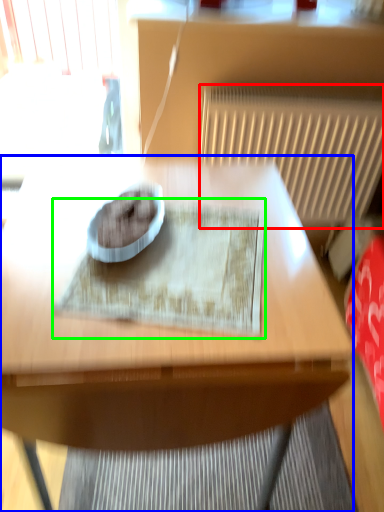
Question: Considering the real-world distances, which object is farthest from radiator (highlighted by a red box)? table (highlighted by a blue box) or mat (highlighted by a green box)?

Choices:
 (A) table
 (B) mat

Answer: (B)